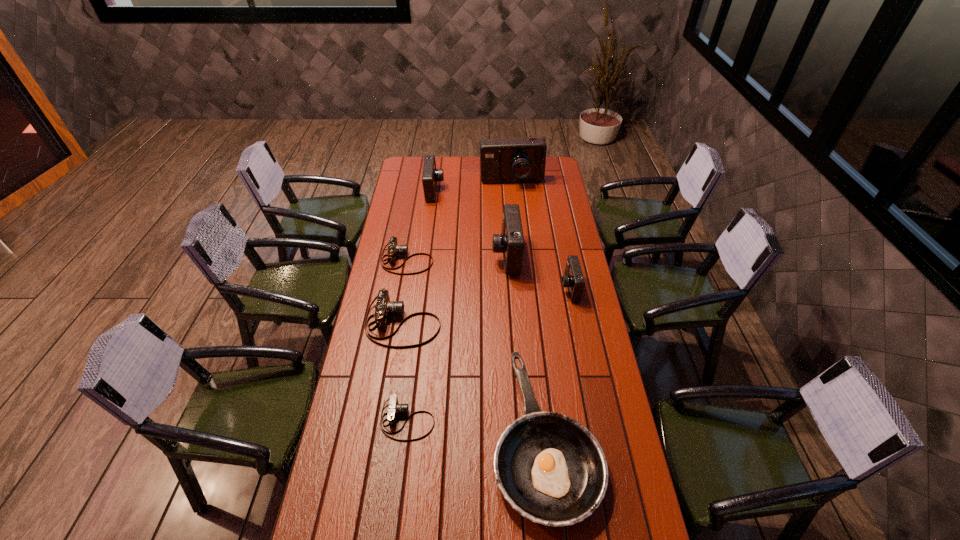
The height and width of the screenshot is (540, 960). What are the coordinates of `vacant space at the far edge of the desktop` in the screenshot? It's located at (476, 174).

In order to click on vacant space at the left edge of the desktop in this screenshot , I will do `click(379, 343)`.

This screenshot has height=540, width=960. What are the coordinates of `free region at the right edge of the desktop` in the screenshot? It's located at (610, 385).

This screenshot has width=960, height=540. Find the location of `vacant area between the fourth tallest camera and the sixth tallest camera`. vacant area between the fourth tallest camera and the sixth tallest camera is located at coordinates (488, 274).

You are a GUI agent. You are given a task and a screenshot of the screen. Output one action in this format:
    pyautogui.click(x=<x>, y=<y>)
    Task: Click on the free space that is in between the third shortest camera and the smallest brown camera
    
    Given the screenshot: What is the action you would take?
    click(405, 372)

This screenshot has height=540, width=960. Identify the location of free area in between the sixth shortest camera and the smallest brown camera. (457, 338).

In order to click on vacant point located between the fourth shortest camera and the second nearest brown camera in this screenshot , I will do (x=486, y=306).

The height and width of the screenshot is (540, 960). Identify the location of free space between the sixth tallest camera and the red frying pan. 476,348.

Image resolution: width=960 pixels, height=540 pixels. What are the coordinates of `vacant area that lies between the shortest object and the smallest blue camera` in the screenshot? It's located at (489, 354).

The width and height of the screenshot is (960, 540). In order to click on the third closest object to the sixth tallest camera in this screenshot , I will do `click(430, 176)`.